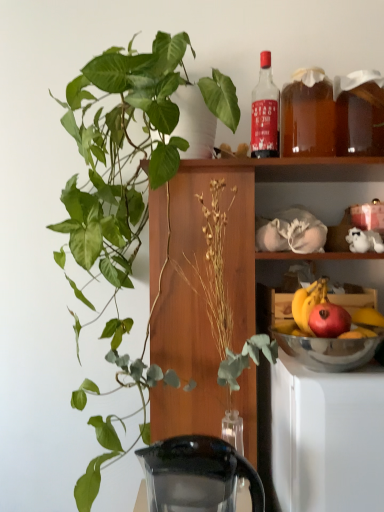
At what (x,y) coordinates should I click in order to perform the action: click on free spot above silver metallic bowl at lower right (from a real-world perspective). Please return your answer as a coordinate pair (x, y). The image size is (384, 512). Looking at the image, I should click on (344, 328).